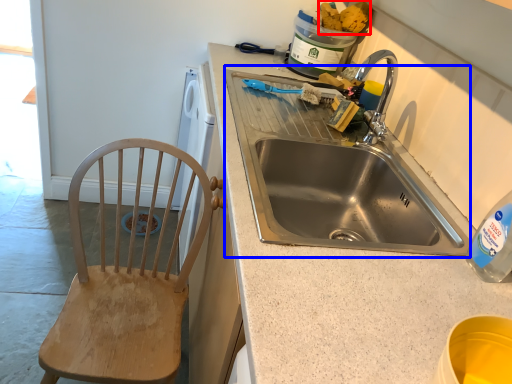
Question: Among these objects, which one is farthest to the camera, food (highlighted by a red box) or sink (highlighted by a blue box)?

Choices:
 (A) food
 (B) sink

Answer: (A)